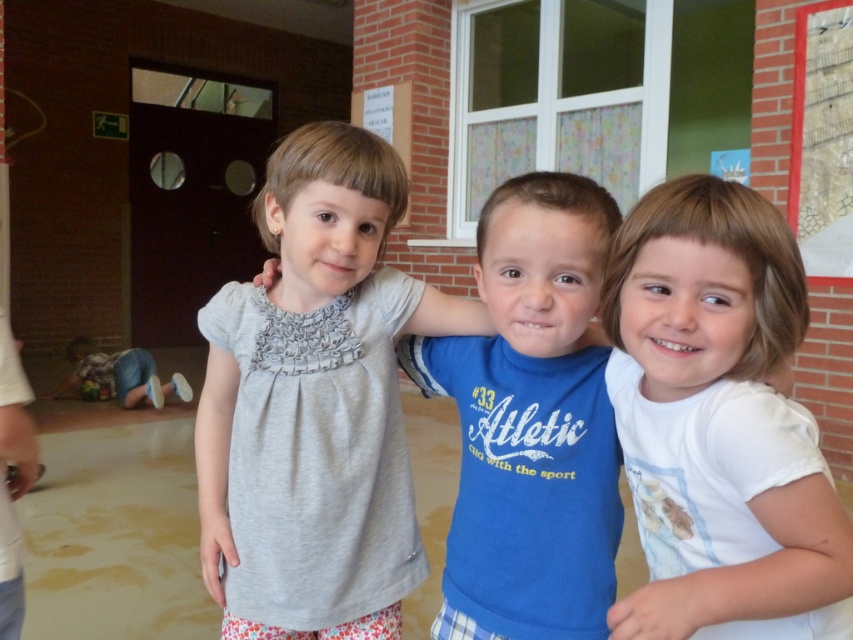
Who is taller, blue cotton shirt at center or blue denim jeans at lower left?

Standing taller between the two is blue cotton shirt at center.

You are a GUI agent. You are given a task and a screenshot of the screen. Output one action in this format:
    pyautogui.click(x=<x>, y=<y>)
    Task: Click on the blue cotton shirt at center
    This screenshot has width=853, height=640.
    Given the screenshot: What is the action you would take?
    pyautogui.click(x=531, y=420)

Where is `blue cotton shirt at center`? blue cotton shirt at center is located at coordinates (531, 420).

Does matte gray shirt at center appear under blue denim jeans at lower left?

No.

Between point (387, 566) and point (94, 348), which one is positioned in front?

Point (387, 566)

The width and height of the screenshot is (853, 640). I want to click on matte gray shirt at center, so click(315, 403).

Locate an element on the screen. This screenshot has width=853, height=640. white cotton shirt at right is located at coordinates (718, 422).

Find the location of `white cotton shirt at right`. white cotton shirt at right is located at coordinates (718, 422).

The height and width of the screenshot is (640, 853). Identify the location of white cotton shirt at right. (718, 422).